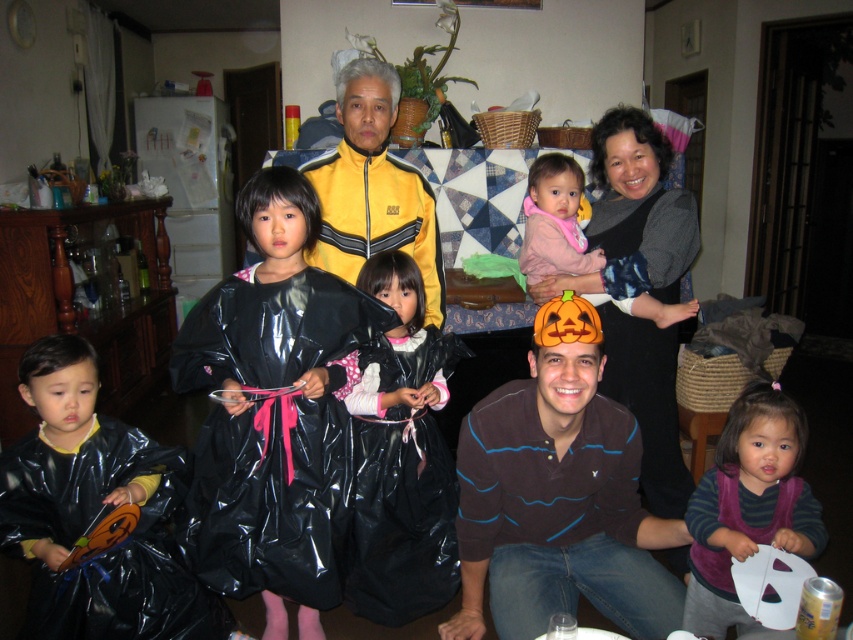
Who is taller, brown striped shirt at center or purple velvet dress at lower right?

Standing taller between the two is brown striped shirt at center.

Which is in front, point (584, 312) or point (811, 534)?

Point (584, 312) is in front.

Identify the location of brown striped shirt at center. (558, 497).

Does purple velvet dress at lower right have a greater height compared to yellowmaterial/texturejacket at upper center?

No.

Which is below, purple velvet dress at lower right or yellowmaterial/texturejacket at upper center?

Positioned lower is purple velvet dress at lower right.

Which is in front, point (776, 444) or point (325, 260)?

Point (776, 444) is in front.

At what (x,y) coordinates should I click in order to perform the action: click on purple velvet dress at lower right. Please return your answer as a coordinate pair (x, y). Looking at the image, I should click on (747, 506).

Between glossy black plastic bag at lower left and yellowmaterial/texturejacket at upper center, which one appears on the right side from the viewer's perspective?

From the viewer's perspective, yellowmaterial/texturejacket at upper center appears more on the right side.

Can you confirm if glossy black plastic bag at lower left is positioned to the right of yellowmaterial/texturejacket at upper center?

No, glossy black plastic bag at lower left is not to the right of yellowmaterial/texturejacket at upper center.

Identify the location of glossy black plastic bag at lower left. The image size is (853, 640). (96, 512).